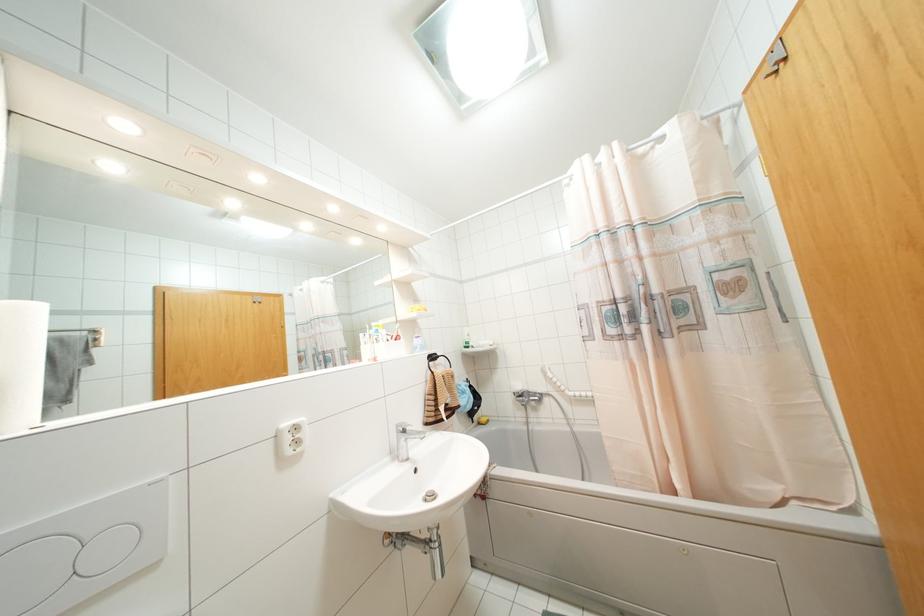
Where would you turn the metal door latch? Please return your answer as a coordinate pair (x, y).

(774, 57)